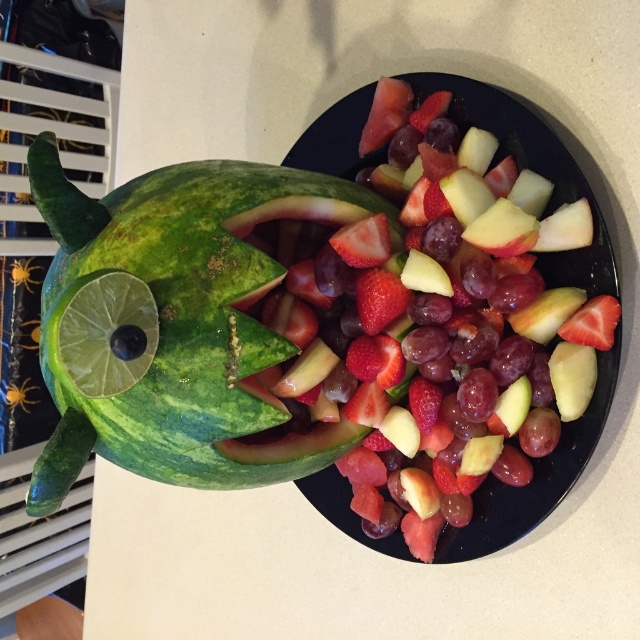
Can you confirm if green striped watermelon at left is bigger than glossy ceramic platter at center?

Actually, green striped watermelon at left might be smaller than glossy ceramic platter at center.

Is green striped watermelon at left closer to the viewer compared to glossy ceramic platter at center?

Yes, it is.

Between point (212, 184) and point (548, 170), which one is positioned in front?

Point (212, 184) is in front.

The image size is (640, 640). What are the coordinates of `green striped watermelon at left` in the screenshot? It's located at (177, 324).